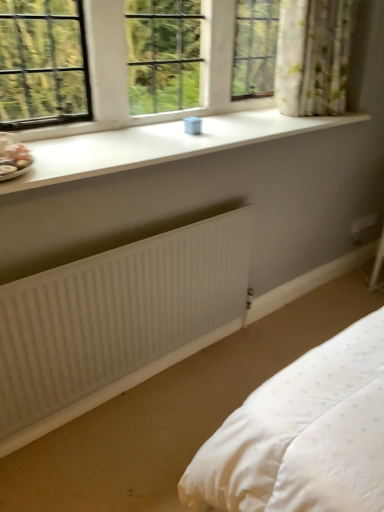
This screenshot has height=512, width=384. I want to click on vacant space in white ribbed radiator at lower center (from a real-world perspective), so click(x=141, y=387).